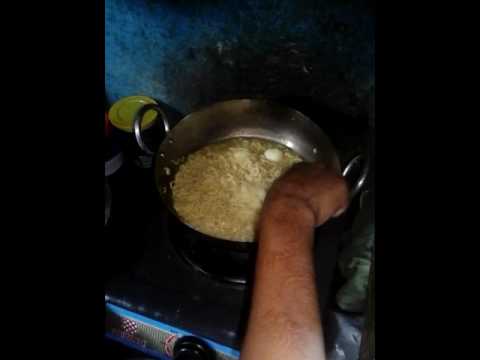
What are the coordinates of `portable stove` in the screenshot? It's located at (164, 325).